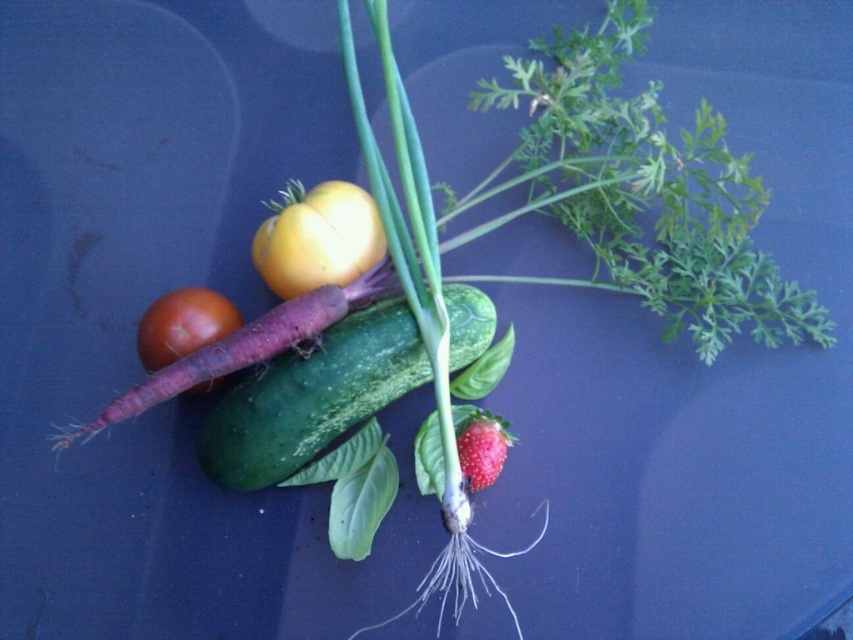
Does matte red tomato at center-left have a lesser width compared to shiny red strawberry at center?

No.

Identify the location of matte red tomato at center-left. This screenshot has width=853, height=640. (183, 324).

In the scene shown: Between green matte cucumber at center and shiny red strawberry at center, which one appears on the left side from the viewer's perspective?

green matte cucumber at center

Which is behind, point (247, 406) or point (473, 444)?

Point (473, 444)

The width and height of the screenshot is (853, 640). Identify the location of green matte cucumber at center. (312, 397).

Is yellow matte tomato at center below shiny red strawberry at center?

No, yellow matte tomato at center is not below shiny red strawberry at center.

Who is lower down, yellow matte tomato at center or shiny red strawberry at center?

Positioned lower is shiny red strawberry at center.

Describe the element at coordinates (317, 237) in the screenshot. The width and height of the screenshot is (853, 640). I see `yellow matte tomato at center` at that location.

In order to click on yellow matte tomato at center in this screenshot , I will do `click(317, 237)`.